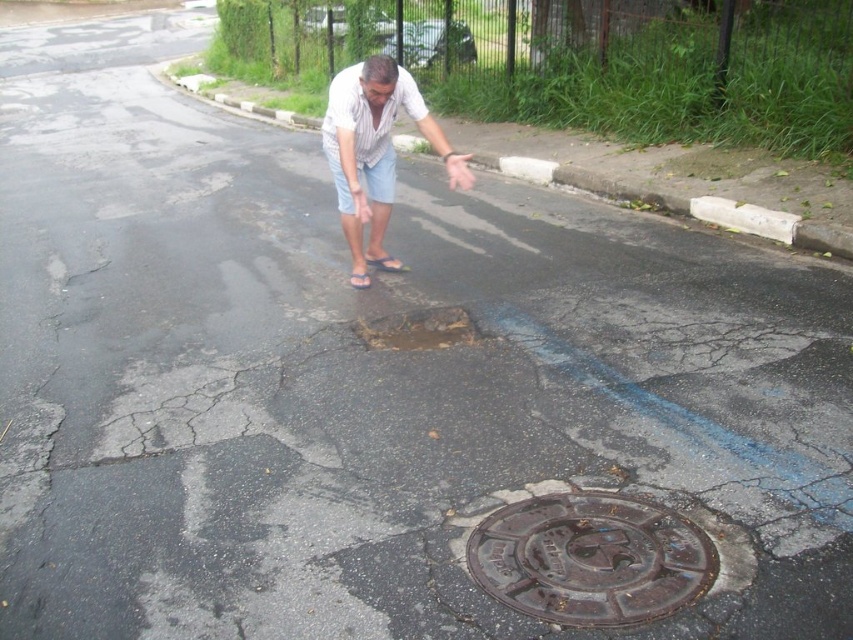
Question: Among these points, which one is farthest from the camera?

Choices:
 (A) (585, 604)
 (B) (370, 234)
 (C) (405, 323)

Answer: (B)

Question: Considering the relative positions of white striped shirt at center and rusty metal manhole cover at center in the image provided, where is white striped shirt at center located with respect to rusty metal manhole cover at center?

Choices:
 (A) below
 (B) above

Answer: (B)

Question: Considering the real-world distances, which object is closest to the white striped shirt at center?

Choices:
 (A) rusty metal manhole cover at center
 (B) brown textured manhole cover at center

Answer: (A)

Question: Which point is farther from the camera taking this photo?

Choices:
 (A) (498, 563)
 (B) (463, 188)

Answer: (B)

Question: Can you confirm if white striped shirt at center is positioned to the right of rusty metal manhole cover at center?

Choices:
 (A) no
 (B) yes

Answer: (A)

Question: Is white striped shirt at center to the left of rusty metal manhole cover at center from the viewer's perspective?

Choices:
 (A) no
 (B) yes

Answer: (B)